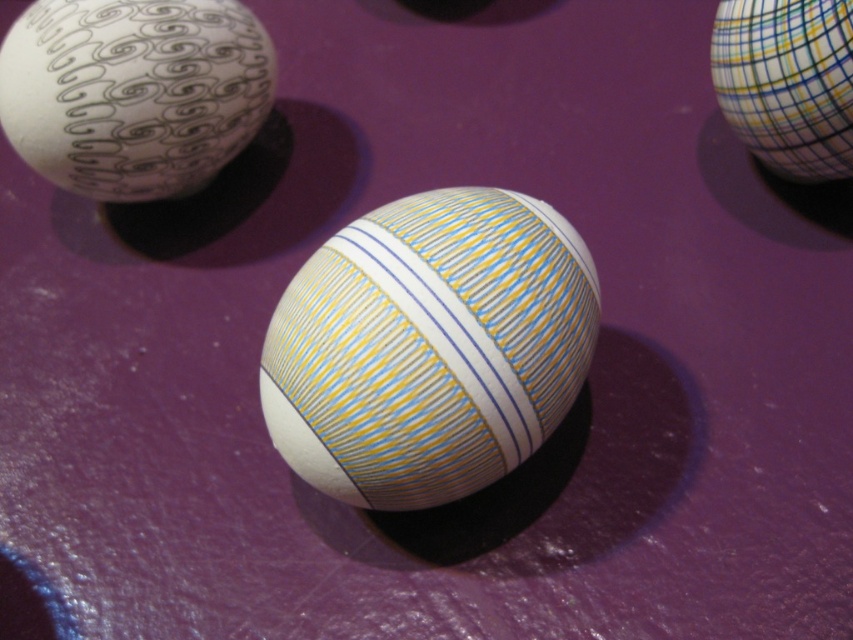
Question: Which point is closer to the camera taking this photo?

Choices:
 (A) (99, 192)
 (B) (488, 323)

Answer: (B)

Question: Which object is the closest to the multicolored striped egg at upper right?

Choices:
 (A) yellow striped egg at center
 (B) white matte egg at upper left

Answer: (A)

Question: Can you confirm if white matte egg at upper left is wider than multicolored striped egg at upper right?

Choices:
 (A) no
 (B) yes

Answer: (B)

Question: From the image, what is the correct spatial relationship of white matte egg at upper left in relation to multicolored striped egg at upper right?

Choices:
 (A) above
 (B) below

Answer: (A)

Question: Is yellow striped egg at center closer to camera compared to multicolored striped egg at upper right?

Choices:
 (A) no
 (B) yes

Answer: (B)

Question: Which of the following is the farthest from the observer?

Choices:
 (A) (833, 3)
 (B) (459, 364)
 (C) (183, 120)

Answer: (C)